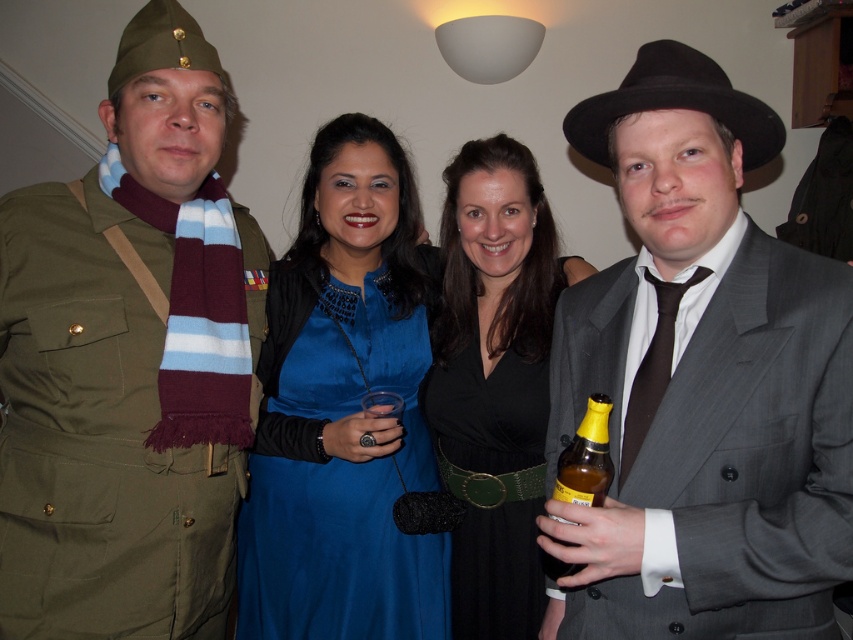
Question: Can you confirm if matte gray suit at center is bigger than satin blue dress at center?

Choices:
 (A) no
 (B) yes

Answer: (B)

Question: From the image, what is the correct spatial relationship of matte olive green uniform at left in relation to blue satin dress at center?

Choices:
 (A) left
 (B) right

Answer: (A)

Question: Does blue satin dress at center appear on the left side of satin blue dress at center?

Choices:
 (A) yes
 (B) no

Answer: (B)

Question: Which point appears closest to the camera in this image?

Choices:
 (A) (509, 580)
 (B) (642, 381)
 (C) (234, 205)
 (D) (584, 564)

Answer: (D)

Question: Estimate the real-world distances between objects in this image. Which object is farther from the translucent glass bottle at lower right?

Choices:
 (A) matte gray suit at center
 (B) satin blue dress at center
 (C) black satin dress at center

Answer: (B)

Question: Estimate the real-world distances between objects in this image. Which object is closer to the satin blue dress at center?

Choices:
 (A) matte olive green uniform at left
 (B) matte gray suit at center
 (C) translucent glass bottle at lower right
 (D) black satin dress at center

Answer: (D)